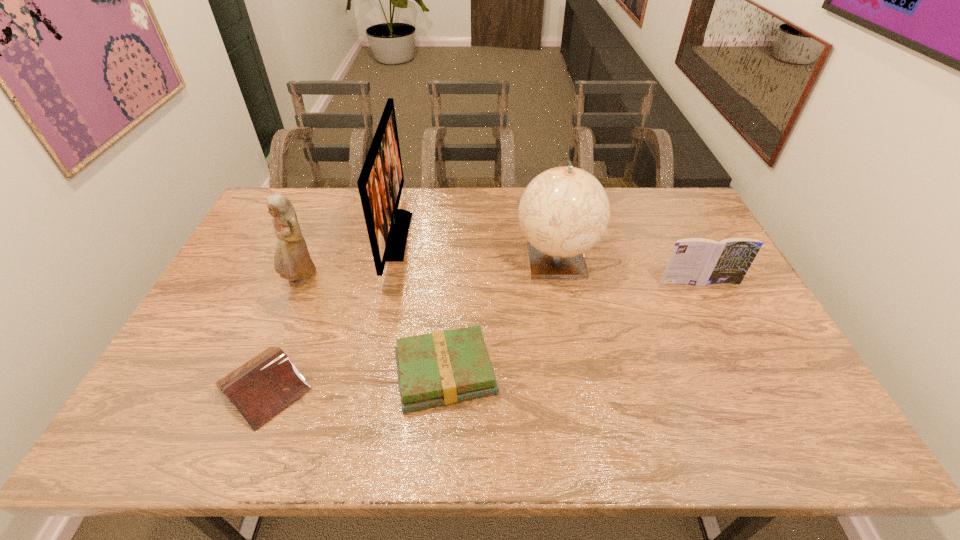
Where is `unoccupied area between the leftmost book and the second book from left to right`? The image size is (960, 540). unoccupied area between the leftmost book and the second book from left to right is located at coordinates 354,380.

This screenshot has width=960, height=540. I want to click on empty location between the globe and the figurine, so click(x=428, y=269).

Where is `object that is the fifth closest one to the third object from left to right`? object that is the fifth closest one to the third object from left to right is located at coordinates [x=694, y=261].

Find the location of a particular element. object that stands as the closest to the third object from right to left is located at coordinates (380, 184).

Point out which book is positioned as the third nearest to the monitor. Please provide its 2D coordinates. Your answer should be formatted as a tuple, i.e. [(x, y)], where the tuple contains the x and y coordinates of a point satisfying the conditions above.

[(694, 261)]

Where is `the closest book relative to the third object from left to right`? The image size is (960, 540). the closest book relative to the third object from left to right is located at coordinates (441, 368).

Find the location of `free space that satisfies the following two spatial constraints: 1. on the front-facing side of the monitor; 2. on the left side of the second book from right to left`. free space that satisfies the following two spatial constraints: 1. on the front-facing side of the monitor; 2. on the left side of the second book from right to left is located at coordinates (364, 374).

Where is `vacant position in the image that satisfies the following two spatial constraints: 1. on the front-facing side of the third object from left to right; 2. on the right side of the second book from right to left`? vacant position in the image that satisfies the following two spatial constraints: 1. on the front-facing side of the third object from left to right; 2. on the right side of the second book from right to left is located at coordinates (364, 374).

Image resolution: width=960 pixels, height=540 pixels. I want to click on vacant point that satisfies the following two spatial constraints: 1. on the front-facing side of the third object from left to right; 2. on the front-facing side of the figurine, so click(385, 280).

The width and height of the screenshot is (960, 540). What are the coordinates of `vacant area in the image that satisfies the following two spatial constraints: 1. on the front-facing side of the monitor; 2. on the front-facing side of the figurine` in the screenshot? It's located at (385, 280).